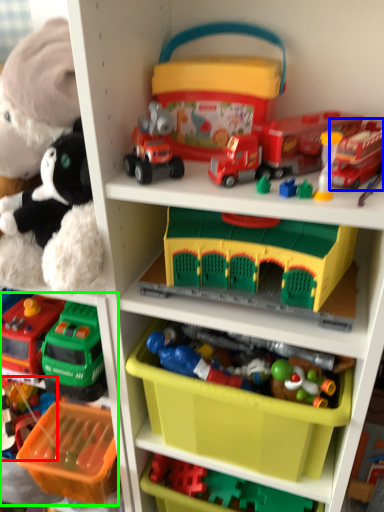
Question: Which object is the farthest from toy (highlighted by a red box)? Choose among these: toy (highlighted by a blue box) or toy (highlighted by a green box).

Choices:
 (A) toy
 (B) toy

Answer: (A)